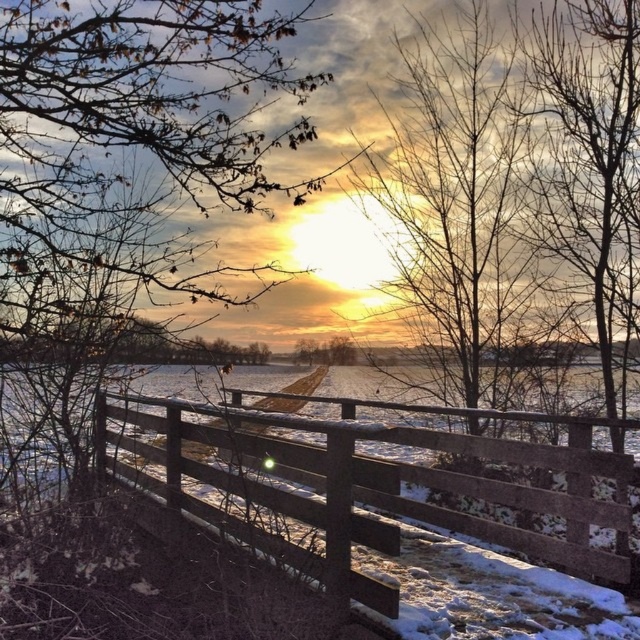
Which is below, wooden fence at center or bare wood tree at upper right?

wooden fence at center is lower down.

From the picture: Who is positioned more to the left, wooden fence at center or bare wood tree at upper right?

From the viewer's perspective, wooden fence at center appears more on the left side.

Locate an element on the screen. The height and width of the screenshot is (640, 640). wooden fence at center is located at coordinates (371, 486).

Is point (76, 280) less distant than point (596, 83)?

That is True.

Does brown leafy branches at upper left have a greater width compared to bare wood tree at upper right?

Yes, brown leafy branches at upper left is wider than bare wood tree at upper right.

Is point (16, 173) positioned after point (620, 269)?

No, it is not.

At what (x,y) coordinates should I click in order to perform the action: click on brown leafy branches at upper left. Please return your answer as a coordinate pair (x, y). Looking at the image, I should click on (131, 154).

Find the location of a particular element. The image size is (640, 640). bare wood tree at upper right is located at coordinates (589, 156).